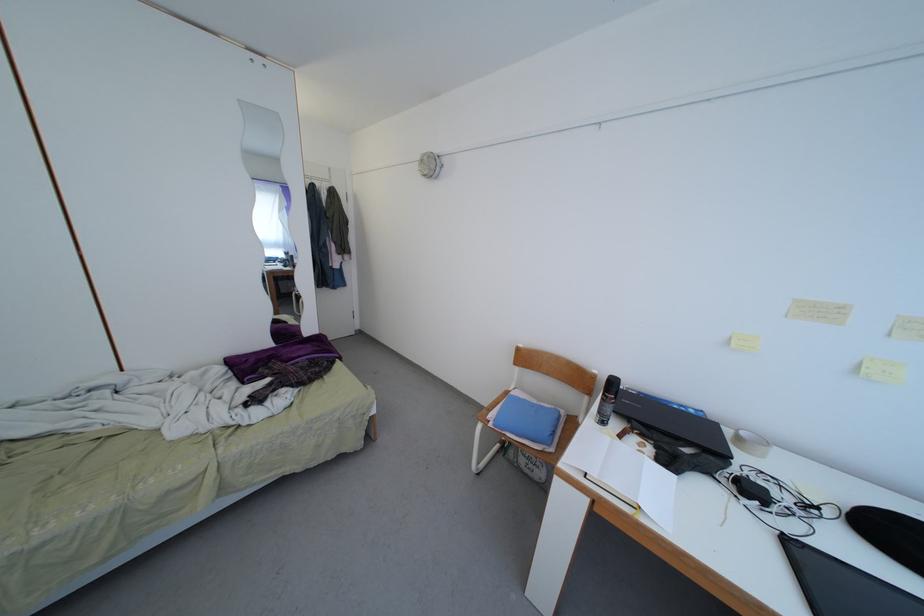
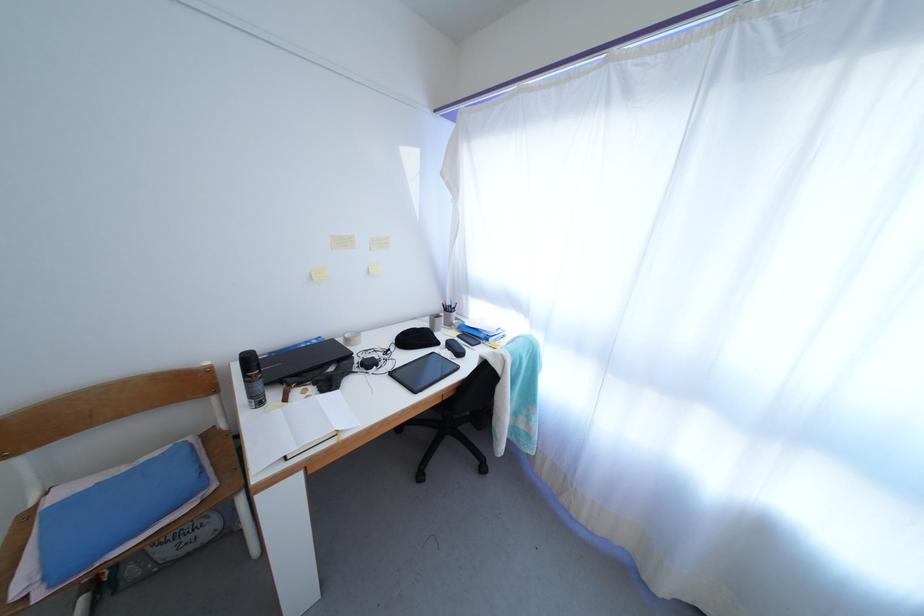
In the second image, find the point that corresponds to point 541,407 in the first image.

(129, 475)